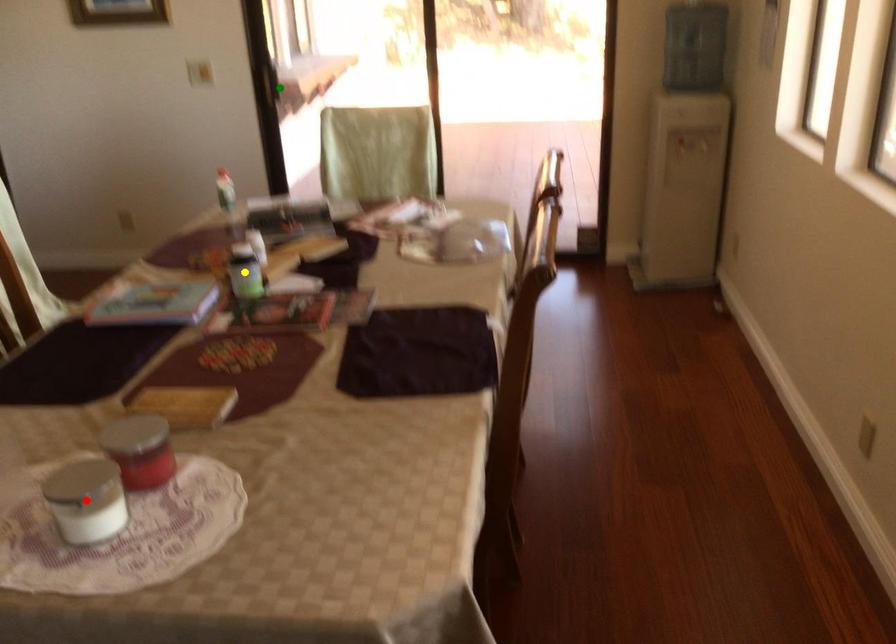
Order these from nearest to farthest:
red point, green point, yellow point

red point, yellow point, green point